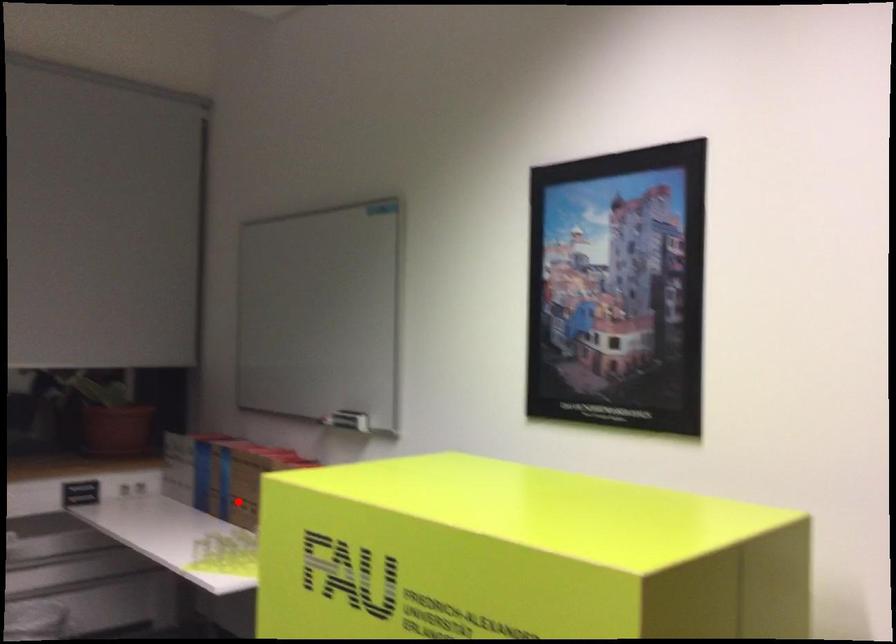
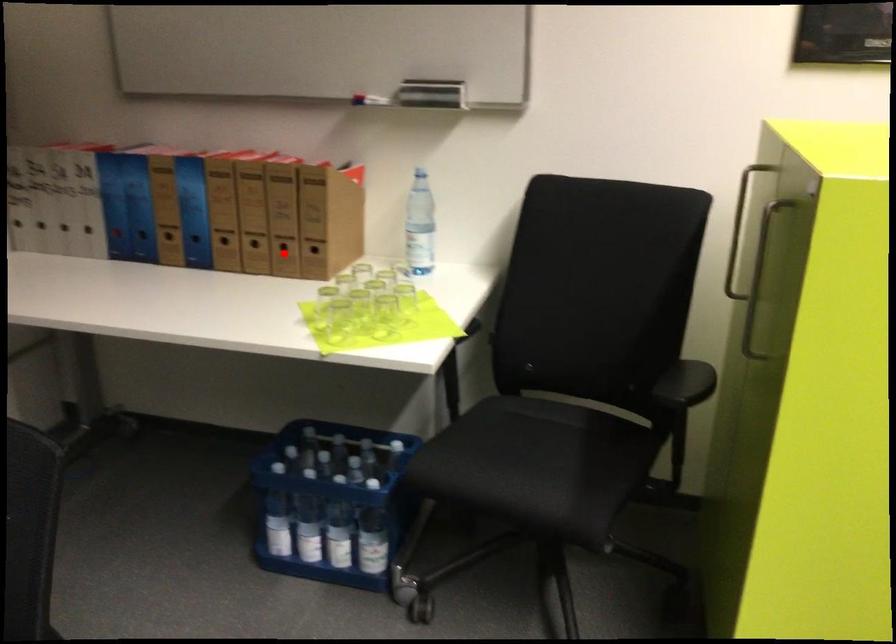
I am providing you with two images of the same scene from different viewpoints. A red point is marked on the first image and another point is marked on the second image. Do the highlighted points in image1 and image2 indicate the same real-world spot?

No